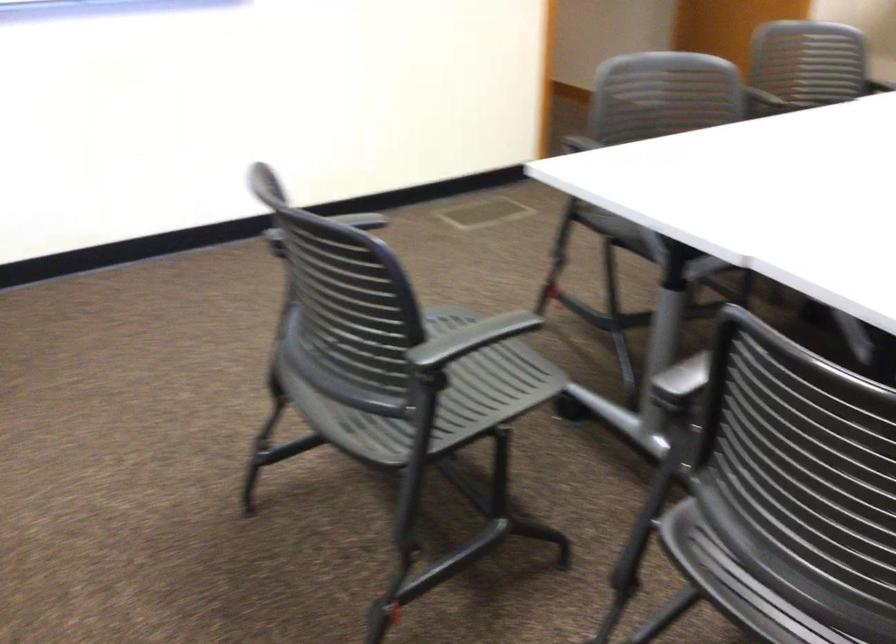
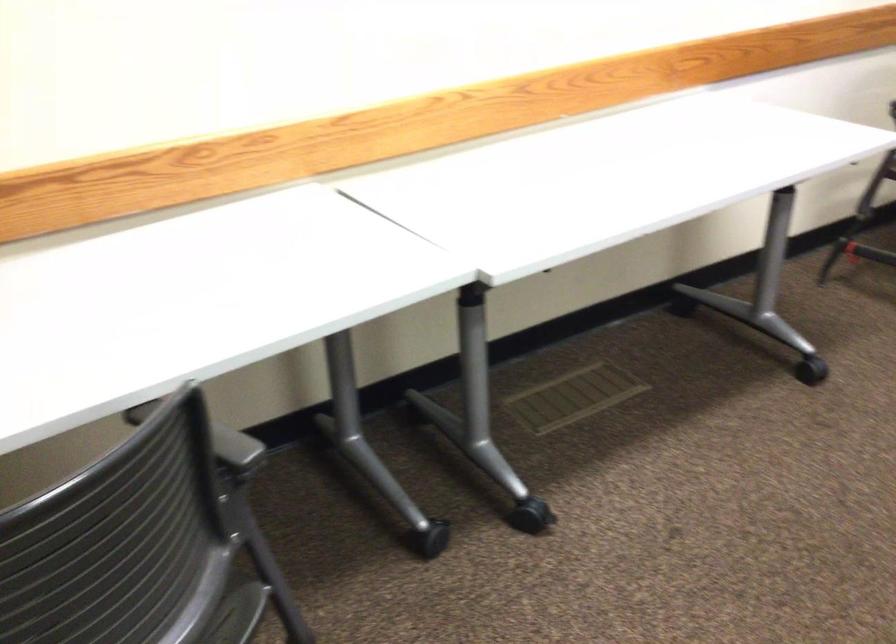
First-person continuous shooting, in which direction is the camera rotating?

The camera rotated toward left-down.